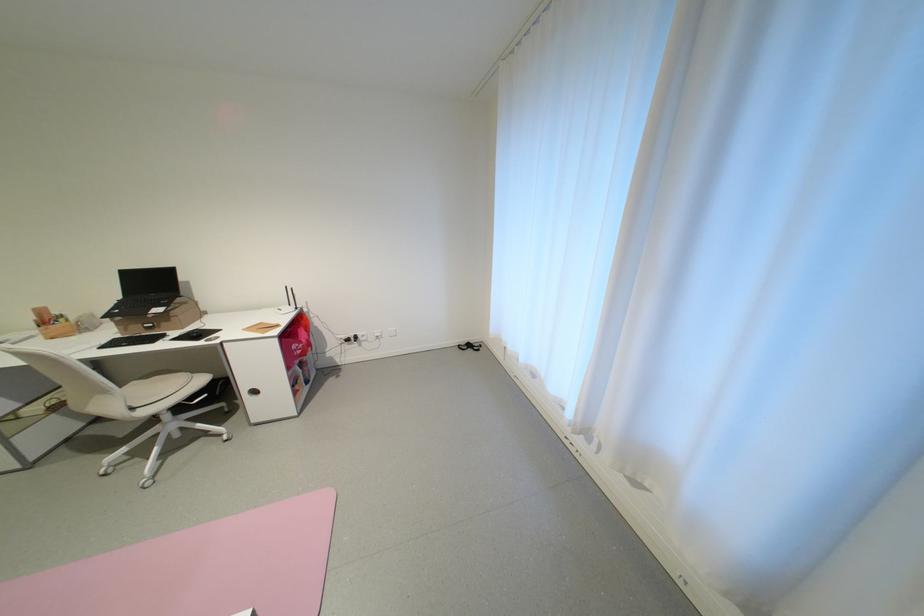
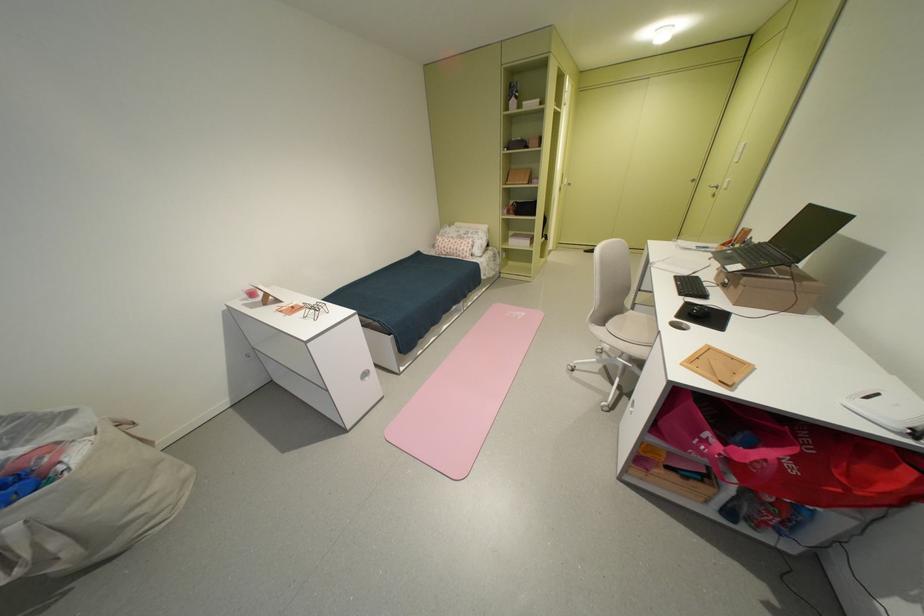
Where in the second image is the point corresponding to point 178,322 from the first image?

(746, 288)